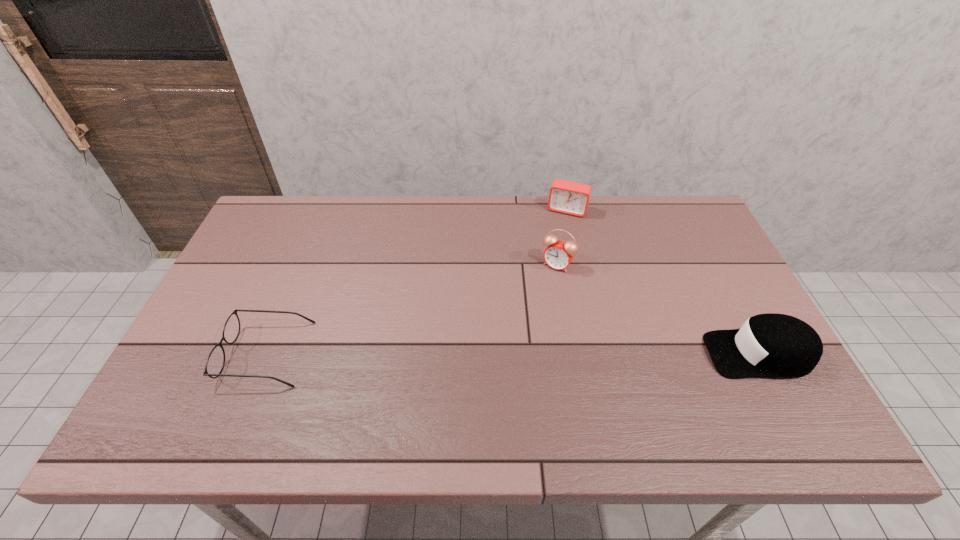
Locate which object is the third closest to the tallest object. Please provide its 2D coordinates. Your answer should be formatted as a tuple, i.e. [(x, y)], where the tuple contains the x and y coordinates of a point satisfying the conditions above.

[(215, 363)]

Locate an element on the screen. The width and height of the screenshot is (960, 540). free region that satisfies the following two spatial constraints: 1. on the back side of the nearer alarm clock; 2. on the right side of the farthest object is located at coordinates (548, 211).